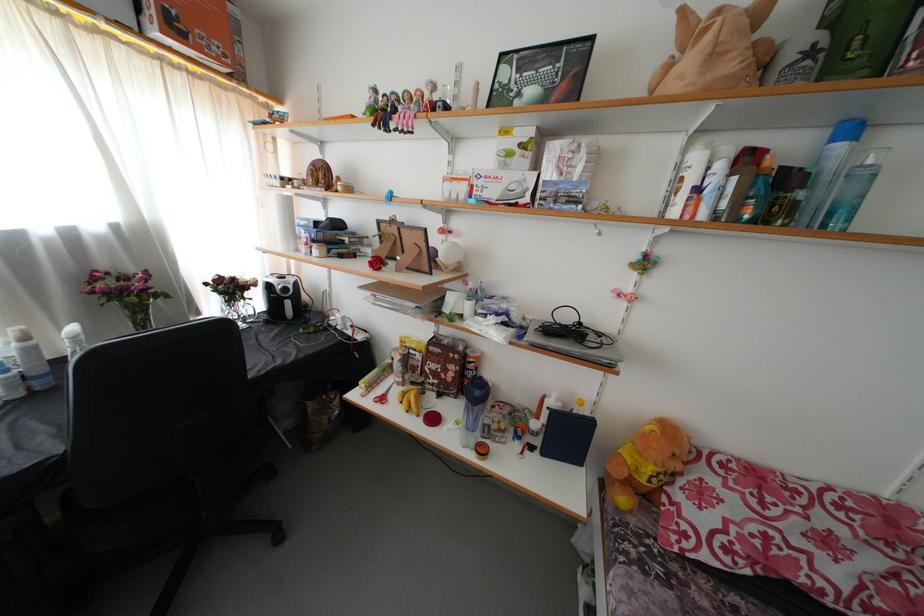
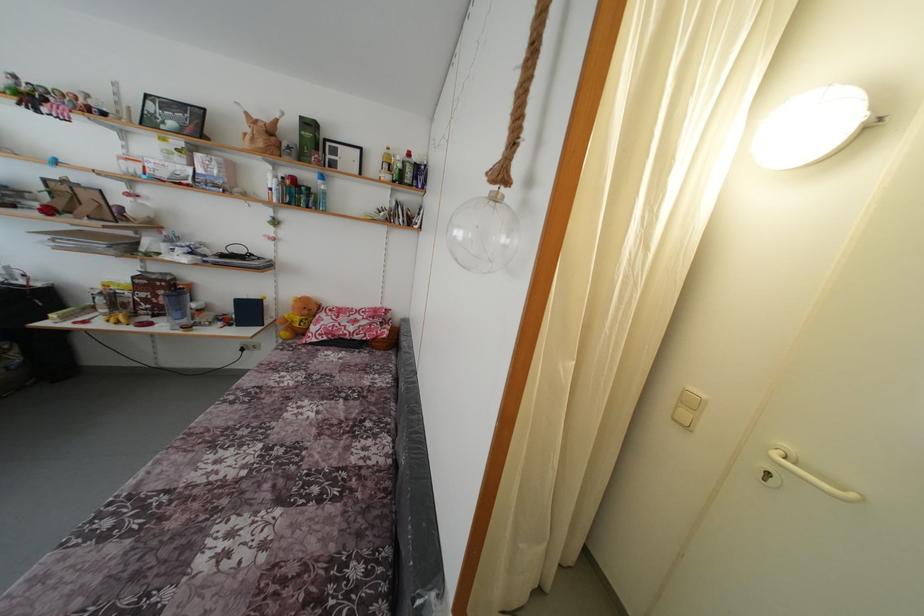
Find the pixel in the second image that matches [845,153] in the first image.

(324, 188)